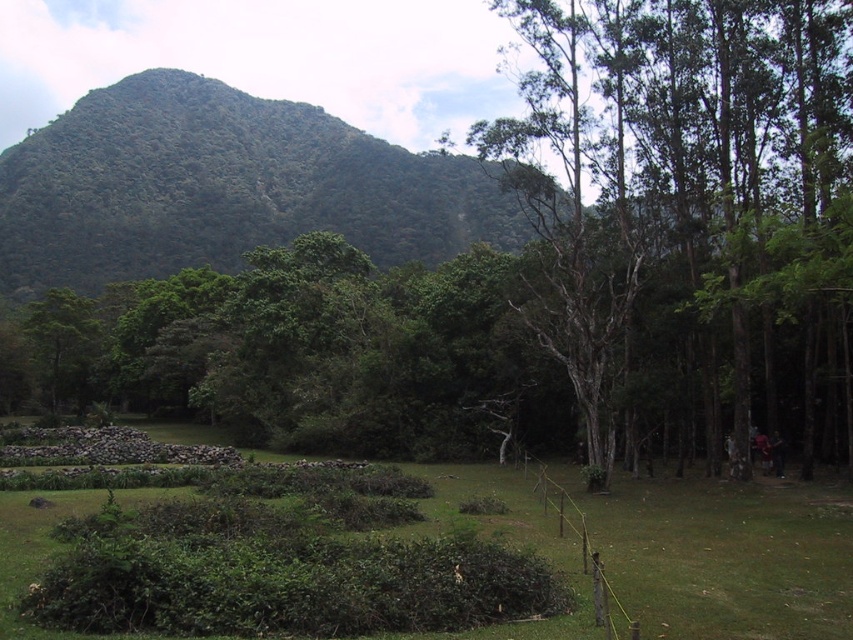
Question: From the image, what is the correct spatial relationship of green leafy hillside at upper left in relation to green leafy hedge at center?

Choices:
 (A) below
 (B) above

Answer: (B)

Question: Which object is the closest to the green leafy tree at right?

Choices:
 (A) green leafy hillside at upper left
 (B) green leafy hedge at center

Answer: (B)

Question: Which of these objects is positioned closest to the green leafy hedge at center?

Choices:
 (A) green leafy tree at right
 (B) green leafy hillside at upper left

Answer: (A)

Question: Can you confirm if green leafy hillside at upper left is positioned above green leafy hedge at center?

Choices:
 (A) no
 (B) yes

Answer: (B)

Question: In this image, where is green leafy hillside at upper left located relative to green leafy hedge at center?

Choices:
 (A) below
 (B) above

Answer: (B)

Question: Which point is farther to the camera?

Choices:
 (A) green leafy hillside at upper left
 (B) green leafy hedge at center

Answer: (A)